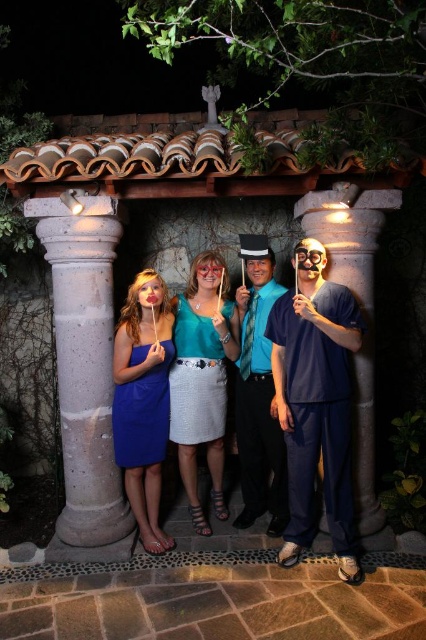
You are a photographer adjusting the camera focus. You notice two teal items in the scene at the center of the image. Which one is taller between the teal fabric skirt at center and the matte teal dress at center?

The teal fabric skirt at center is taller than the matte teal dress at center according to the description.

You are standing in front of the stone archway and want to take a photo of the matte blue dress at left. Where should you aim your camera to capture it?

You should aim your camera at point (143, 406) to capture the matte blue dress at left as that is its exact position.